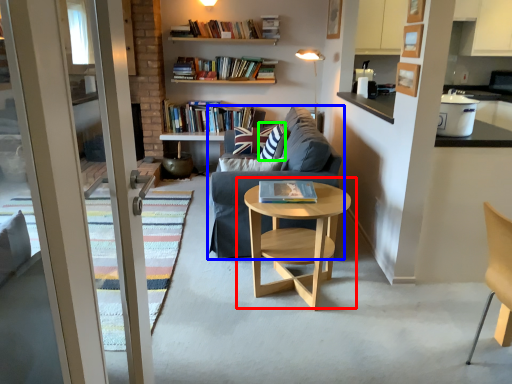
Question: Which is nearer to the coffee table (highlighted by a red box)? studio couch (highlighted by a blue box) or pillow (highlighted by a green box).

Choices:
 (A) studio couch
 (B) pillow

Answer: (A)